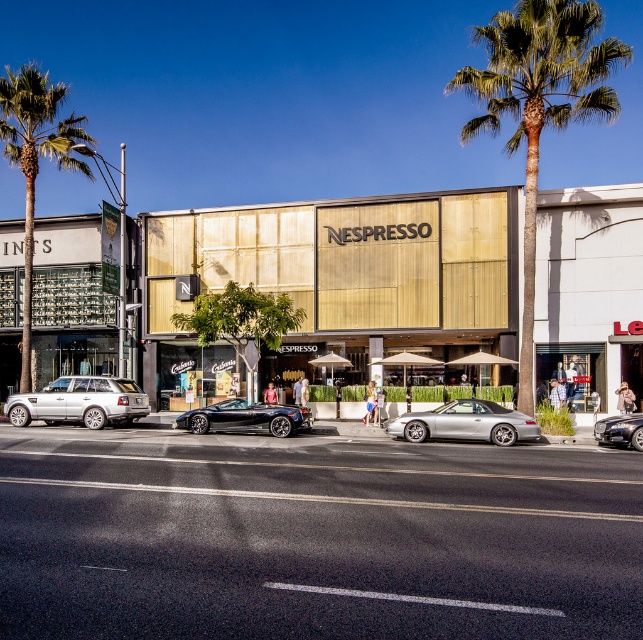
Is gold wood nespresso at center taller than green leafy palm tree at center?

Incorrect, gold wood nespresso at center's height is not larger of green leafy palm tree at center's.

Is gold wood nespresso at center thinner than green leafy palm tree at center?

Yes.

Is point (592, 259) closer to camera compared to point (538, 120)?

No, (592, 259) is further to viewer.

Where is `gold wood nespresso at center`? gold wood nespresso at center is located at coordinates 332,284.

Who is higher up, gold wood nespresso at center or shiny black car at center?

gold wood nespresso at center is above.

Is gold wood nespresso at center wider than shiny black car at center?

Yes.

This screenshot has width=643, height=640. Identify the location of gold wood nespresso at center. (332, 284).

The image size is (643, 640). Identify the location of gold wood nespresso at center. (332, 284).

Can you confirm if silver metallic car at center is smaller than shiny black convertible at center?

Actually, silver metallic car at center might be larger than shiny black convertible at center.

Is silver metallic car at center behind shiny black convertible at center?

No, it is not.

I want to click on silver metallic car at center, so click(466, 422).